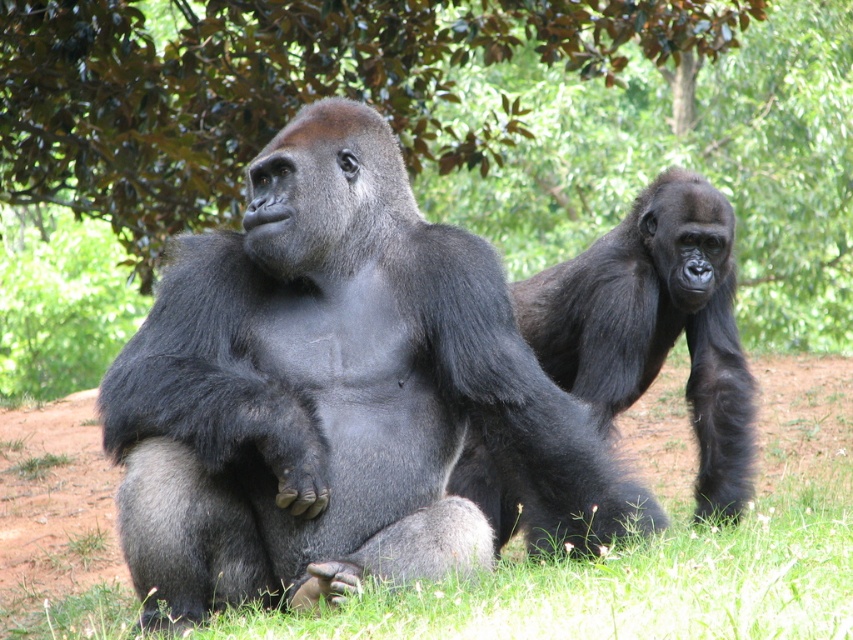
You are a photographer trying to capture both the shiny dark fur gorilla at center and the green leafy tree at upper center in the same frame. Based on their sizes, which object should you focus on first to ensure both fit in the photo?

The shiny dark fur gorilla at center is thinner than the green leafy tree at upper center, so you should focus on the green leafy tree at upper center first to ensure both fit in the photo.

Based on the coordinates provided, where is the shiny dark fur gorilla at center located in the image?

The shiny dark fur gorilla at center is located at the 2D coordinates point (337, 394) in the image.